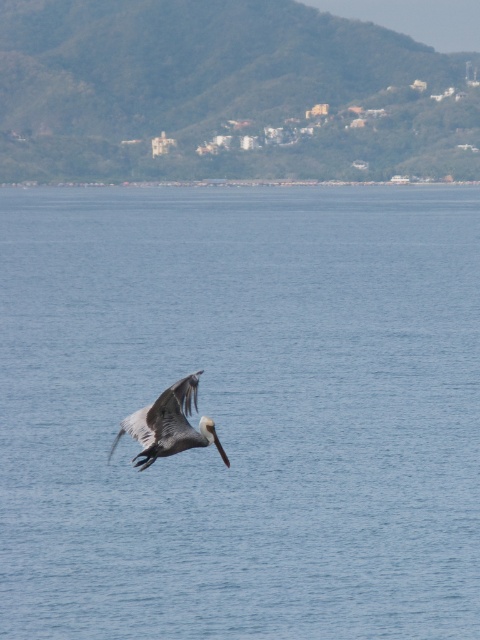
Is blue water at center thinner than brown feathered pelican at center?

No, blue water at center is not thinner than brown feathered pelican at center.

Between blue water at center and brown feathered pelican at center, which one is positioned lower?

brown feathered pelican at center is below.

This screenshot has height=640, width=480. Describe the element at coordinates (240, 412) in the screenshot. I see `blue water at center` at that location.

Find the location of a particular element. The height and width of the screenshot is (640, 480). blue water at center is located at coordinates (240, 412).